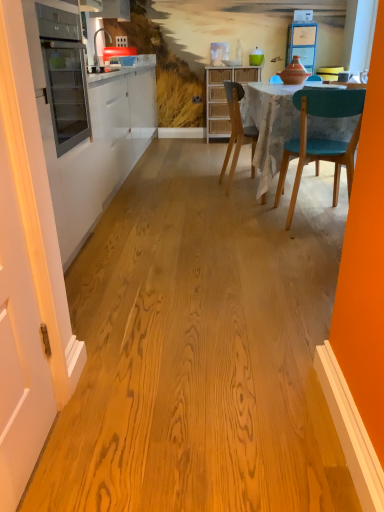
Identify the location of matte gray chair at center. (x=237, y=131).

Describe the element at coordinates (237, 131) in the screenshot. The image size is (384, 512). I see `matte gray chair at center` at that location.

This screenshot has height=512, width=384. Describe the element at coordinates (223, 96) in the screenshot. I see `woven wood cabinet at center` at that location.

In order to face white painted wood door at left, should I rotate leftwards or rightwards?

Turn left by 24.620 degrees to look at white painted wood door at left.

Where is `matte glass oven at left`? The image size is (384, 512). matte glass oven at left is located at coordinates (64, 75).

Are matte gray chair at center and teal glossy vase at upper center located far from each other?

matte gray chair at center is positioned a significant distance from teal glossy vase at upper center.

Which object is positioned more to the left, matte gray chair at center or teal glossy vase at upper center?

Positioned to the left is matte gray chair at center.

Considering the relative sizes of matte gray chair at center and teal glossy vase at upper center in the image provided, is matte gray chair at center taller than teal glossy vase at upper center?

Yes, matte gray chair at center is taller than teal glossy vase at upper center.

Looking at their sizes, would you say matte gray chair at center is wider or thinner than teal glossy vase at upper center?

matte gray chair at center is wider than teal glossy vase at upper center.

Choose the correct answer: Is teal glossy vase at upper center inside white painted wood door at left or outside it?

teal glossy vase at upper center is located beyond the bounds of white painted wood door at left.

Image resolution: width=384 pixels, height=512 pixels. In order to click on door located on the left of teal glossy vase at upper center in this screenshot , I will do `click(24, 270)`.

Consider the image. Visually, is teal glossy vase at upper center positioned to the left or to the right of white painted wood door at left?

Clearly, teal glossy vase at upper center is on the right of white painted wood door at left in the image.

Is teal glossy vase at upper center facing towards white painted wood door at left?

Yes, teal glossy vase at upper center is oriented towards white painted wood door at left.

Between matte glass oven at left and woven wood cabinet at center, which one has larger width?

woven wood cabinet at center.

Is matte glass oven at left taller than woven wood cabinet at center?

Incorrect, the height of matte glass oven at left is not larger of that of woven wood cabinet at center.

Is woven wood cabinet at center surrounded by matte glass oven at left?

Actually, woven wood cabinet at center is outside matte glass oven at left.

Which is in front, point (62, 145) or point (226, 114)?

The point (62, 145) is closer.

Relative to matte gray chair at center, is teal glossy vase at upper center in front or behind?

Visually, teal glossy vase at upper center is located behind matte gray chair at center.

Is teal glossy vase at upper center taller or shorter than matte gray chair at center?

Considering their sizes, teal glossy vase at upper center has less height than matte gray chair at center.

Considering the sizes of objects teal glossy vase at upper center and matte gray chair at center in the image provided, who is smaller, teal glossy vase at upper center or matte gray chair at center?

teal glossy vase at upper center.

From the image's perspective, which one is positioned higher, teal glossy vase at upper center or matte glass oven at left?

teal glossy vase at upper center.

Which of these two, teal glossy vase at upper center or matte glass oven at left, stands shorter?

teal glossy vase at upper center.

Which is more to the left, teal glossy vase at upper center or matte glass oven at left?

matte glass oven at left.

The image size is (384, 512). Find the location of `appliance below the teal glossy vase at upper center (from a real-world perspective)`. appliance below the teal glossy vase at upper center (from a real-world perspective) is located at coordinates click(x=64, y=75).

Considering the points (210, 119) and (257, 64), which point is behind, point (210, 119) or point (257, 64)?

The point (257, 64) is behind.

In the image, is woven wood cabinet at center positioned in front of or behind teal glossy vase at upper center?

In the image, woven wood cabinet at center appears in front of teal glossy vase at upper center.

Is woven wood cabinet at center facing towards teal glossy vase at upper center?

No, woven wood cabinet at center is not aimed at teal glossy vase at upper center.

Does teal glossy vase at upper center turn towards woven wood cabinet at center?

No.

Is teal glossy vase at upper center beside woven wood cabinet at center?

No, teal glossy vase at upper center is not with woven wood cabinet at center.

From a real-world perspective, between teal glossy vase at upper center and woven wood cabinet at center, who is vertically lower?

From a 3D spatial view, woven wood cabinet at center is below.

Consider the image. From the image's perspective, is teal glossy vase at upper center located above woven wood cabinet at center?

Yes, from the image's perspective, teal glossy vase at upper center is on top of woven wood cabinet at center.

Where is `chair that is below the teal glossy vase at upper center (from the image's perspective)`? This screenshot has width=384, height=512. chair that is below the teal glossy vase at upper center (from the image's perspective) is located at coordinates (237, 131).

This screenshot has width=384, height=512. What are the coordinates of `door on the left of teal glossy vase at upper center` in the screenshot? It's located at (24, 270).

Estimate the real-world distances between objects in this image. Which object is further from matte glass oven at left, matte gray chair at center or white painted wood door at left?

The object further to matte glass oven at left is matte gray chair at center.

When comparing their distances from white painted wood door at left, does matte gray chair at center or woven wood cabinet at center seem closer?

Among the two, matte gray chair at center is located nearer to white painted wood door at left.

Considering their positions, is matte gray chair at center positioned further to teal glossy vase at upper center than matte glass oven at left?

The object further to teal glossy vase at upper center is matte glass oven at left.

Looking at the image, which one is located closer to matte glass oven at left, white painted wood door at left or teal glossy vase at upper center?

white painted wood door at left.

Estimate the real-world distances between objects in this image. Which object is further from woven wood cabinet at center, matte glass oven at left or white painted wood door at left?

Based on the image, white painted wood door at left appears to be further to woven wood cabinet at center.

Looking at the image, which one is located closer to teal glossy vase at upper center, woven wood cabinet at center or matte glass oven at left?

Based on the image, woven wood cabinet at center appears to be nearer to teal glossy vase at upper center.

When comparing their distances from woven wood cabinet at center, does matte glass oven at left or teal glossy vase at upper center seem further?

matte glass oven at left is positioned further to the anchor woven wood cabinet at center.

Looking at this image, based on their spatial positions, is matte glass oven at left or matte gray chair at center further from teal glossy vase at upper center?

matte glass oven at left.

This screenshot has width=384, height=512. In order to click on chair between matte glass oven at left and teal glossy vase at upper center along the z-axis in this screenshot , I will do `click(237, 131)`.

Find the location of `cabinetry positioned between matte glass oven at left and teal glossy vase at upper center from near to far`. cabinetry positioned between matte glass oven at left and teal glossy vase at upper center from near to far is located at coordinates (223, 96).

Identify the location of appliance between white painted wood door at left and matte gray chair at center in the front-back direction. [x=64, y=75].

Find the location of `appliance positioned between white painted wood door at left and woven wood cabinet at center from near to far`. appliance positioned between white painted wood door at left and woven wood cabinet at center from near to far is located at coordinates (64, 75).